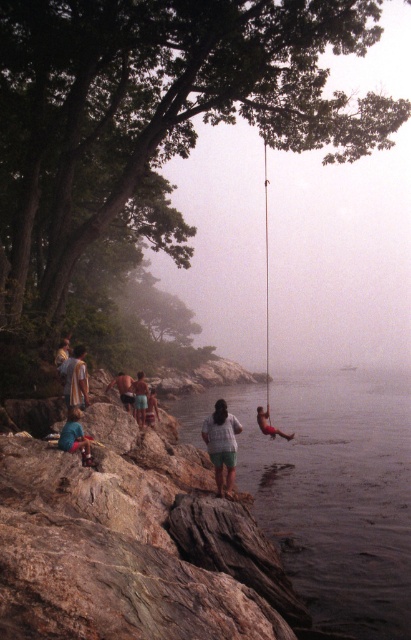
You are a photographer positioned at the center of the scene. You want to capture a photo that includes both the transparent water at swing right and the blue cotton shorts at lower left. Which object should you adjust your camera to focus on first to ensure both are in the frame?

You should focus on the transparent water at swing right first because it is in front of the blue cotton shorts at lower left, so adjusting the focus starting from the closer object will help ensure both are in the frame.